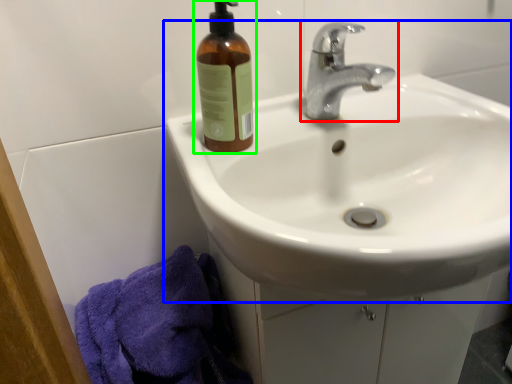
Question: Estimate the real-world distances between objects in this image. Which object is farther from tap (highlighted by a red box), sink (highlighted by a blue box) or bottle (highlighted by a green box)?

Choices:
 (A) sink
 (B) bottle

Answer: (B)